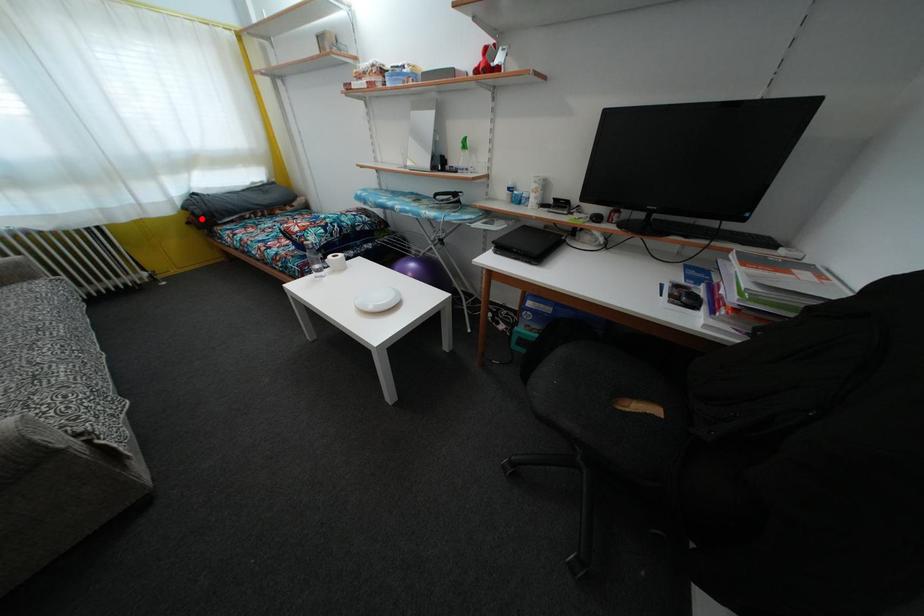
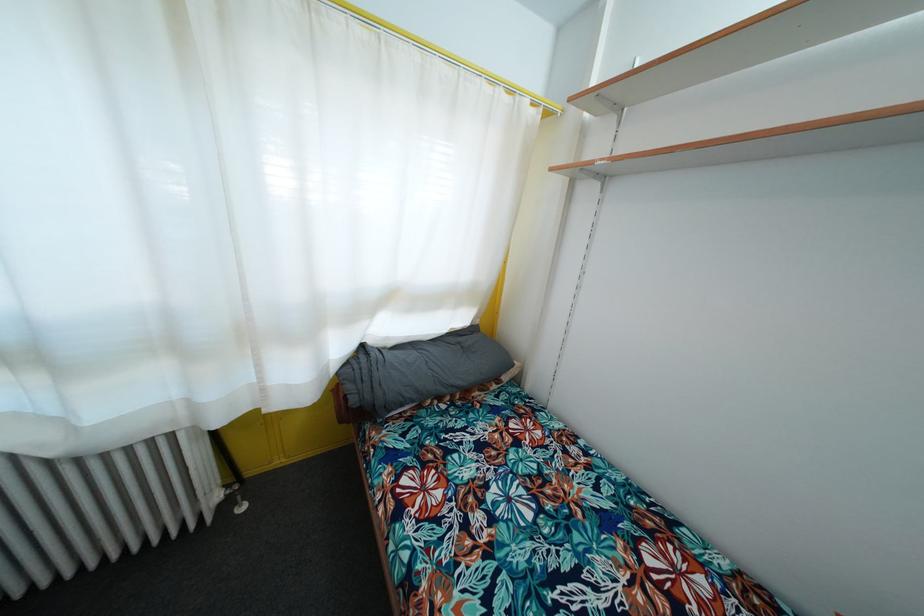
Question: I am providing you with two images of the same scene from different viewpoints. A red point is marked on the first image. Can you still see the location of the red point in image 2?

Choices:
 (A) Yes
 (B) No

Answer: (A)